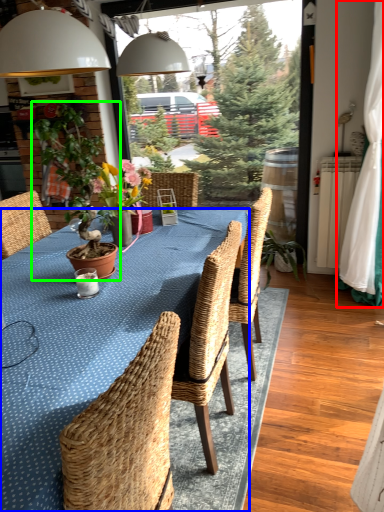
Question: Which is nearer to the curtain (highlighted by a red box)? kitchen & dining room table (highlighted by a blue box) or houseplant (highlighted by a green box).

Choices:
 (A) kitchen & dining room table
 (B) houseplant

Answer: (A)